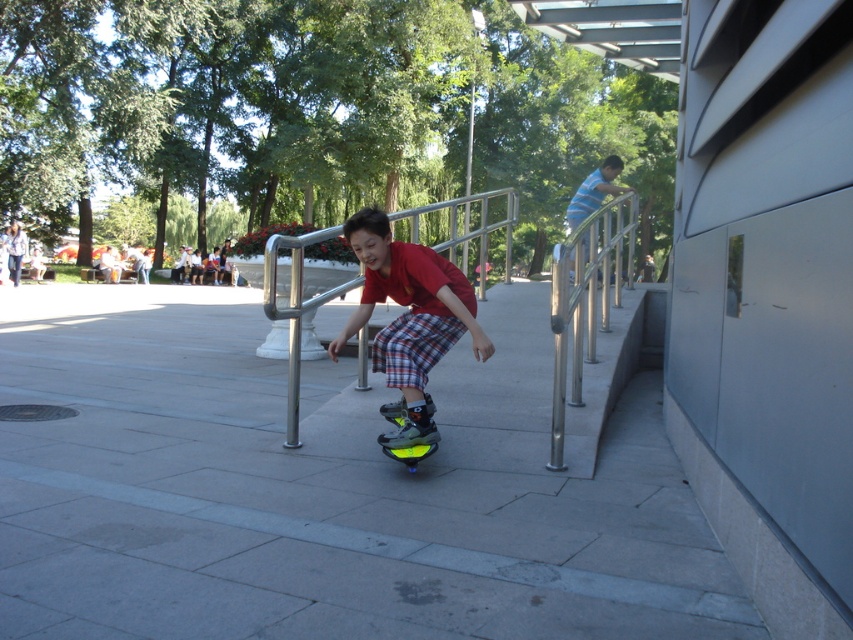
Does gray concrete pavement at center have a greater height compared to matte red shirt at center?

Yes, gray concrete pavement at center is taller than matte red shirt at center.

Is gray concrete pavement at center positioned before matte red shirt at center?

Yes, it is.

Locate an element on the screen. Image resolution: width=853 pixels, height=640 pixels. gray concrete pavement at center is located at coordinates (329, 486).

Where is `gray concrete pavement at center`? gray concrete pavement at center is located at coordinates (329, 486).

Is matte red shirt at center bigger than neon yellow plastic skateboard at center?

Yes, matte red shirt at center is bigger than neon yellow plastic skateboard at center.

Does matte red shirt at center appear on the right side of neon yellow plastic skateboard at center?

Incorrect, matte red shirt at center is not on the right side of neon yellow plastic skateboard at center.

Identify the location of matte red shirt at center. (x=409, y=317).

Is point (115, 628) positioned in front of point (401, 422)?

Yes, point (115, 628) is in front of point (401, 422).

Can you confirm if gray concrete pavement at center is positioned to the right of neon yellow plastic skateboard at center?

In fact, gray concrete pavement at center is to the left of neon yellow plastic skateboard at center.

Locate an element on the screen. gray concrete pavement at center is located at coordinates (329, 486).